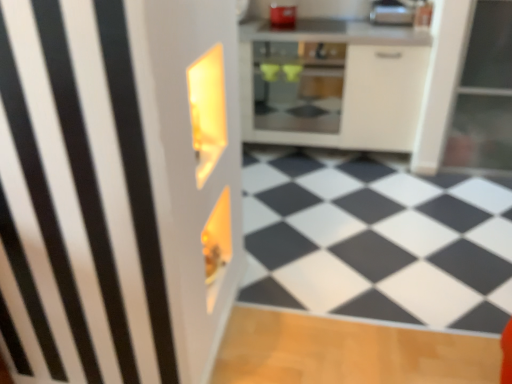
Question: Is silver metallic toaster at upper right, the 2th appliance when ordered from left to right, inside the boundaries of white glossy cabinet at center, or outside?

Choices:
 (A) inside
 (B) outside

Answer: (B)

Question: Considering their positions, is silver metallic toaster at upper right, which ranks as the first appliance in right-to-left order, located in front of or behind white glossy cabinet at center?

Choices:
 (A) front
 (B) behind

Answer: (B)

Question: Based on their relative distances, which object is farther from the silver metallic toaster at upper right, the 2th appliance when ordered from left to right?

Choices:
 (A) white glossy cabinet at center
 (B) matte glass oven at center
 (C) metallic silver toaster at upper center, which is the second appliance in right-to-left order

Answer: (B)

Question: Estimate the real-world distances between objects in this image. Which object is closer to the metallic silver toaster at upper center, which is the second appliance in right-to-left order?

Choices:
 (A) silver metallic toaster at upper right, the 2th appliance when ordered from left to right
 (B) matte glass oven at center
 (C) white glossy cabinet at center

Answer: (B)